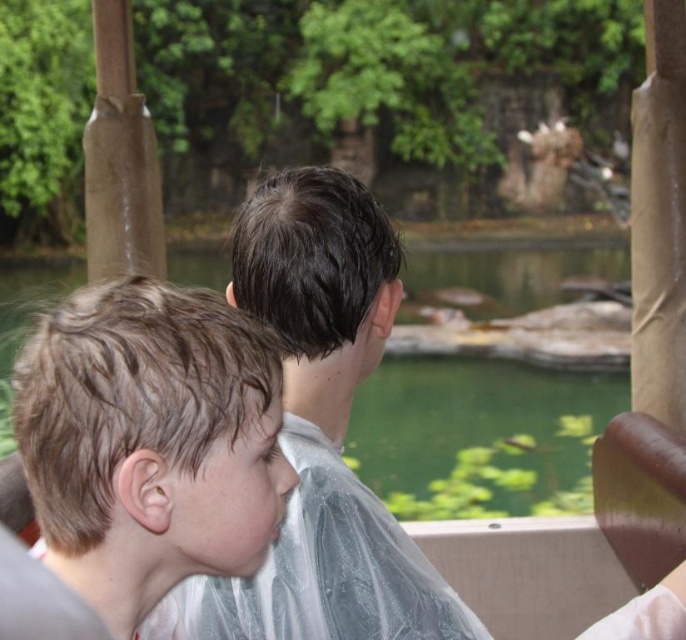
Is light brown hair at left shorter than transparent plastic water at center?

Yes, light brown hair at left is shorter than transparent plastic water at center.

Between light brown hair at left and transparent plastic water at center, which one appears on the right side from the viewer's perspective?

transparent plastic water at center

This screenshot has height=640, width=686. I want to click on light brown hair at left, so click(x=150, y=442).

Identify the location of light brown hair at left. The image size is (686, 640). (150, 442).

Measure the distance from translucent plastic bag at center to transparent plastic water at center.

A distance of 14.86 feet exists between translucent plastic bag at center and transparent plastic water at center.

Who is more forward, (480, 625) or (416, 451)?

Point (480, 625)

Where is `translucent plastic bag at center`? translucent plastic bag at center is located at coordinates (324, 428).

Can you confirm if light brown hair at left is positioned below translucent plastic bag at center?

Correct, light brown hair at left is located below translucent plastic bag at center.

Between light brown hair at left and translucent plastic bag at center, which one has less height?

light brown hair at left is shorter.

Is point (213, 296) positioned behind point (279, 332)?

No.

Locate an element on the screen. The image size is (686, 640). light brown hair at left is located at coordinates (150, 442).